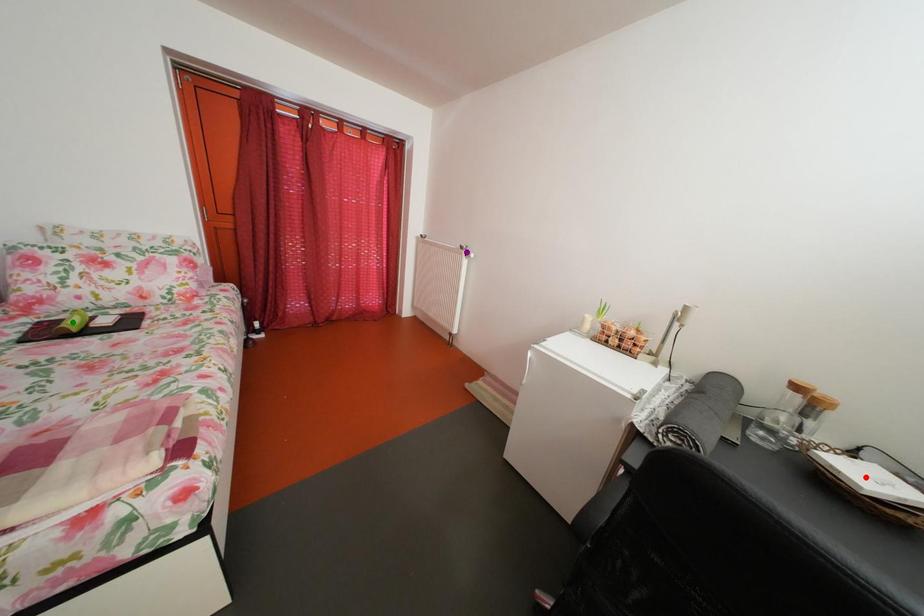
Order these from nearest to farthest:
1. red point
2. green point
3. purple point

purple point < green point < red point